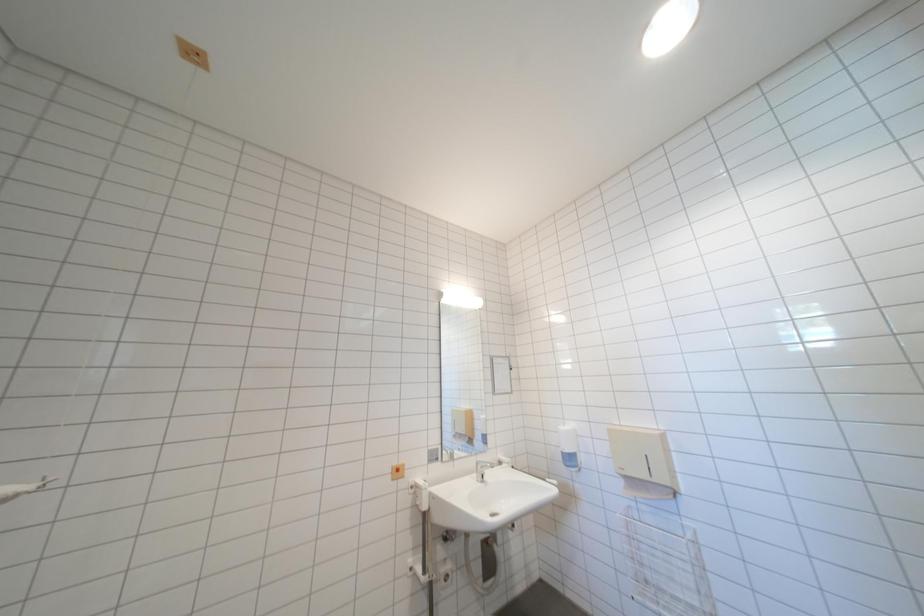
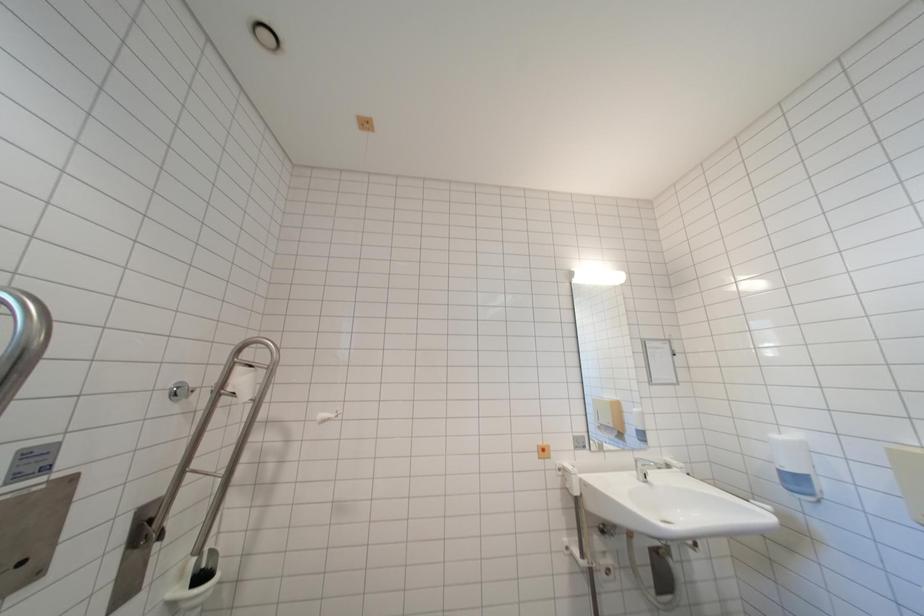
Question: The first image is from the beginning of the video and the second image is from the end. How did the camera likely rotate when shooting the video?

Choices:
 (A) Left
 (B) Right
 (C) Up
 (D) Down

Answer: (A)